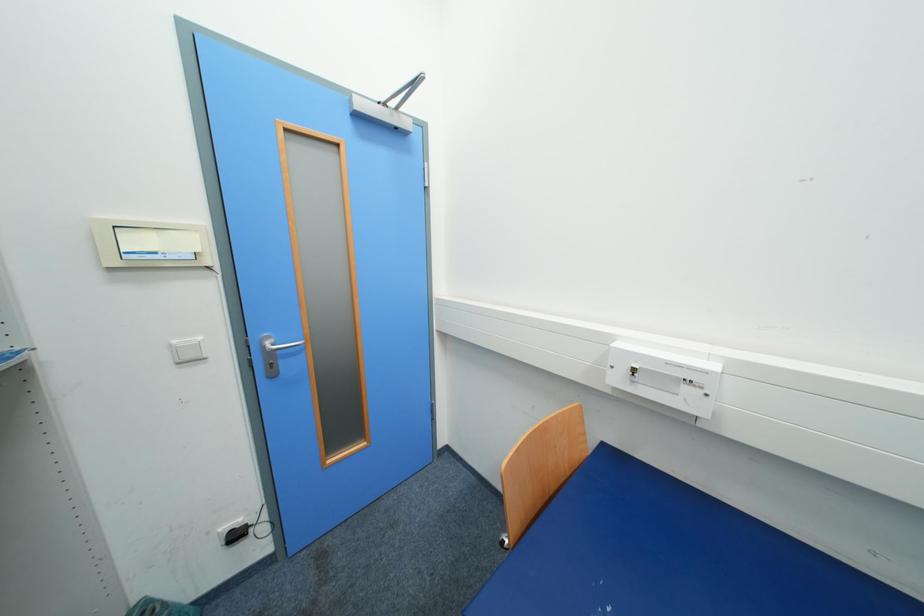
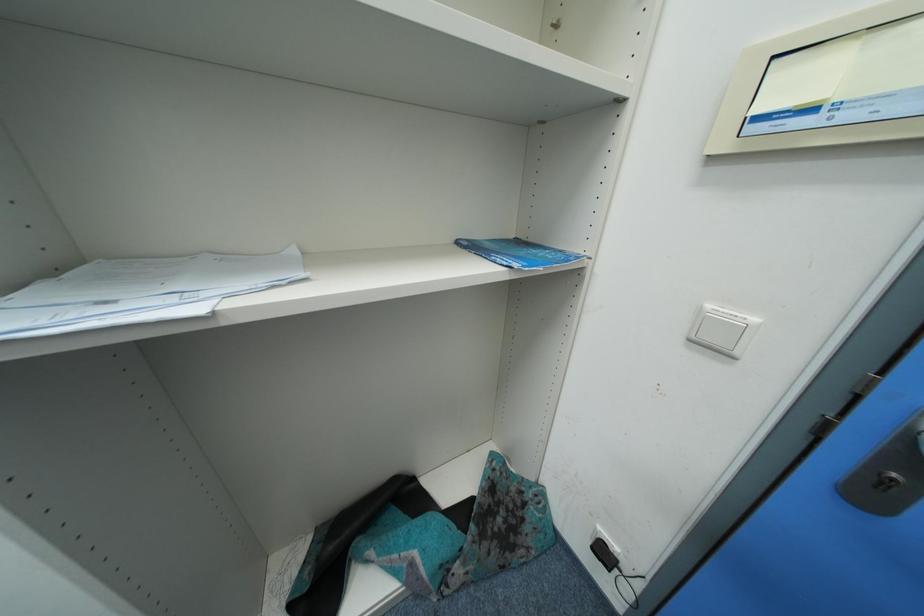
Based on the continuous images, in which direction is the camera rotating?

The rotation direction of the camera is left-down.